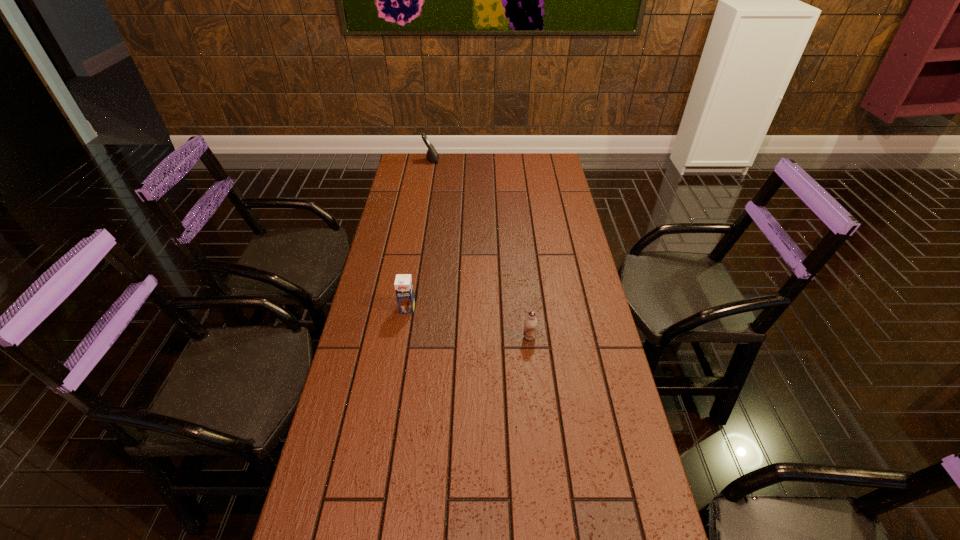
Where is `the farthest object`? The height and width of the screenshot is (540, 960). the farthest object is located at coordinates (432, 155).

Image resolution: width=960 pixels, height=540 pixels. Find the location of `the left chocolate milk`. the left chocolate milk is located at coordinates (403, 284).

Image resolution: width=960 pixels, height=540 pixels. In order to click on the taller chocolate milk in this screenshot , I will do `click(403, 284)`.

Find the location of `the nearer chocolate milk`. the nearer chocolate milk is located at coordinates (530, 324).

The width and height of the screenshot is (960, 540). I want to click on the right chocolate milk, so click(x=530, y=324).

Identify the location of free spot located 0.270m on the front-facing side of the farthest object. This screenshot has height=540, width=960. (494, 160).

Image resolution: width=960 pixels, height=540 pixels. I want to click on vacant space situated on the front label of the left chocolate milk, so pyautogui.click(x=392, y=407).

Locate an element on the screen. free space located 0.330m on the left of the rightmost object is located at coordinates (415, 337).

Where is `object present at the far edge`? Image resolution: width=960 pixels, height=540 pixels. object present at the far edge is located at coordinates (432, 155).

Find the location of a particular element. cellular telephone that is at the left edge is located at coordinates (432, 155).